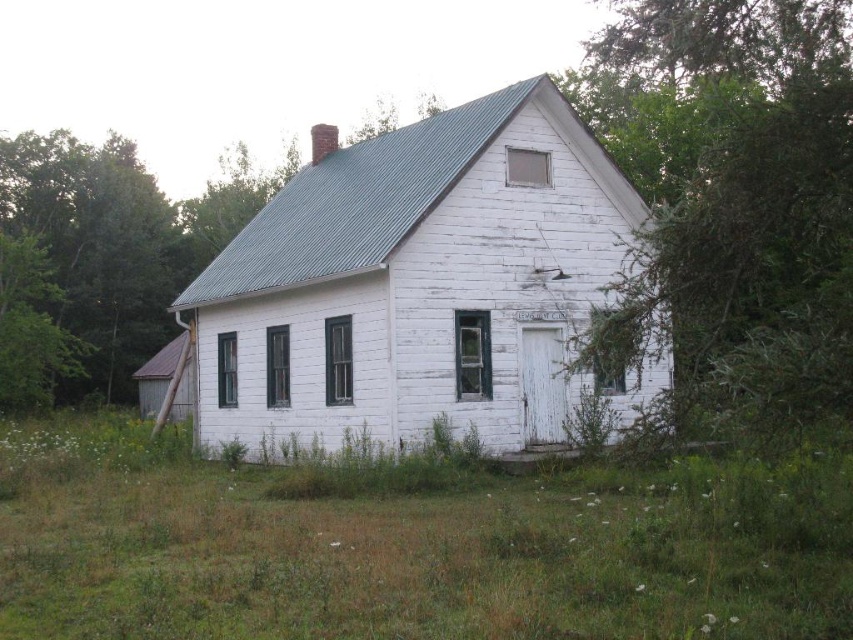
Is the position of green leafy tree at right less distant than that of green leafy tree at left?

Yes, it is in front of green leafy tree at left.

Which of these two, green leafy tree at right or green leafy tree at left, stands taller?

With more height is green leafy tree at right.

Identify the location of green leafy tree at right. (732, 193).

Looking at this image, can you confirm if green grass at lower center is bigger than green leafy tree at right?

Incorrect, green grass at lower center is not larger than green leafy tree at right.

Who is lower down, green grass at lower center or green leafy tree at right?

green grass at lower center is below.

You are a GUI agent. You are given a task and a screenshot of the screen. Output one action in this format:
    pyautogui.click(x=<x>, y=<y>)
    Task: Click on the green grass at lower center
    This screenshot has width=853, height=640.
    Given the screenshot: What is the action you would take?
    pyautogui.click(x=410, y=547)

Measure the distance from green grass at lower center to green leafy tree at left.

33.24 meters

Does point (143, 525) lie behind point (86, 198)?

That is False.

Locate an element on the screen. The image size is (853, 640). green grass at lower center is located at coordinates point(410,547).